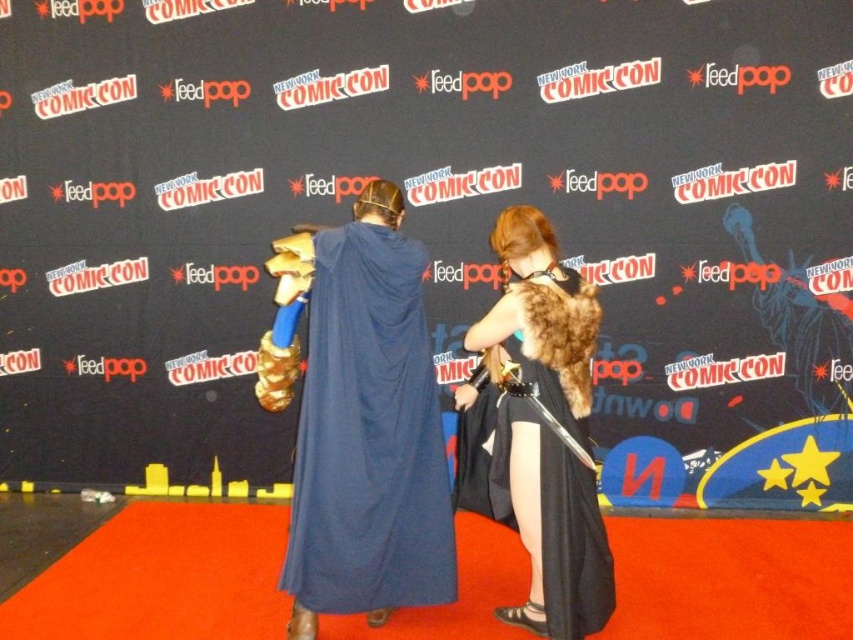
You are standing in front of the Comic Con backdrop. There is a point marked at coordinates (368, 435). What is located at that point?

The point at coordinates (368, 435) indicates blue drapery at center.